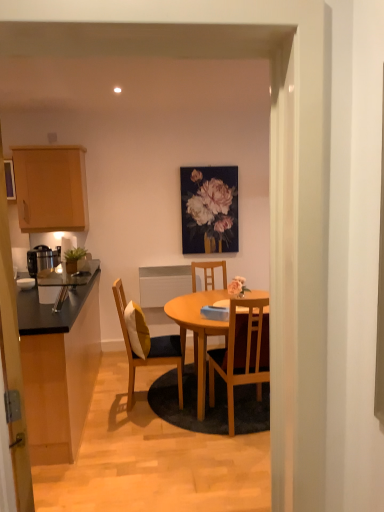
Question: Does wooden chair with cushion at center, positioned as the first chair in left-to-right order, lie behind wooden chair at center, which is the 3th chair from front to back?

Choices:
 (A) yes
 (B) no

Answer: (B)

Question: Does wooden chair with cushion at center, the 2th chair when ordered from front to back, appear on the left side of wooden chair at center, which is the 3th chair from front to back?

Choices:
 (A) no
 (B) yes

Answer: (B)

Question: From the image's perspective, would you say wooden chair with cushion at center, positioned as the 2th chair in back-to-front order, is shown under wooden chair at center, which is the 3th chair from front to back?

Choices:
 (A) no
 (B) yes

Answer: (B)

Question: Considering the relative sizes of wooden chair with cushion at center, the third chair viewed from the right, and wooden chair at center, the 2th chair in the right-to-left sequence, in the image provided, is wooden chair with cushion at center, the third chair viewed from the right, thinner than wooden chair at center, the 2th chair in the right-to-left sequence,?

Choices:
 (A) no
 (B) yes

Answer: (B)

Question: From a real-world perspective, is wooden chair with cushion at center, the 2th chair when ordered from front to back, physically above wooden chair at center, which ranks as the 1th chair in back-to-front order?

Choices:
 (A) yes
 (B) no

Answer: (A)

Question: From a real-world perspective, relative to wooden chair at center, which ranks as the 1th chair in back-to-front order, is black laminate countertop at left, which is the first cabinetry in bottom-to-top order, vertically above or below?

Choices:
 (A) above
 (B) below

Answer: (B)

Question: Is black laminate countertop at left, marked as the second cabinetry in a top-to-bottom arrangement, in front of or behind wooden chair at center, the 2th chair in the right-to-left sequence, in the image?

Choices:
 (A) front
 (B) behind

Answer: (A)

Question: Based on their positions, is black laminate countertop at left, which is the first cabinetry in bottom-to-top order, located to the left or right of wooden chair at center, which ranks as the 2th chair in left-to-right order?

Choices:
 (A) right
 (B) left

Answer: (B)

Question: Is black laminate countertop at left, marked as the second cabinetry in a top-to-bottom arrangement, inside or outside of wooden chair at center, which ranks as the 2th chair in left-to-right order?

Choices:
 (A) inside
 (B) outside

Answer: (B)

Question: Considering the positions of black laminate countertop at left, marked as the second cabinetry in a top-to-bottom arrangement, and wooden chair at center, arranged as the third chair when viewed from the left, in the image, is black laminate countertop at left, marked as the second cabinetry in a top-to-bottom arrangement, bigger or smaller than wooden chair at center, arranged as the third chair when viewed from the left,?

Choices:
 (A) small
 (B) big

Answer: (B)

Question: Is black laminate countertop at left, which is the first cabinetry in bottom-to-top order, inside the boundaries of wooden chair at center, which is counted as the third chair, starting from the back, or outside?

Choices:
 (A) inside
 (B) outside

Answer: (B)

Question: From the image's perspective, is black laminate countertop at left, which is the first cabinetry in bottom-to-top order, positioned above or below wooden chair at center, which is counted as the third chair, starting from the back?

Choices:
 (A) above
 (B) below

Answer: (B)

Question: Looking at their shapes, would you say black laminate countertop at left, which is the first cabinetry in bottom-to-top order, is wider or thinner than wooden chair at center, arranged as the third chair when viewed from the left?

Choices:
 (A) wide
 (B) thin

Answer: (A)

Question: Is wooden cabinet at upper left, the first cabinetry when ordered from top to bottom, inside the boundaries of transparent glass door at left, or outside?

Choices:
 (A) inside
 (B) outside

Answer: (B)

Question: Is wooden cabinet at upper left, the first cabinetry when ordered from top to bottom, bigger or smaller than transparent glass door at left?

Choices:
 (A) small
 (B) big

Answer: (B)